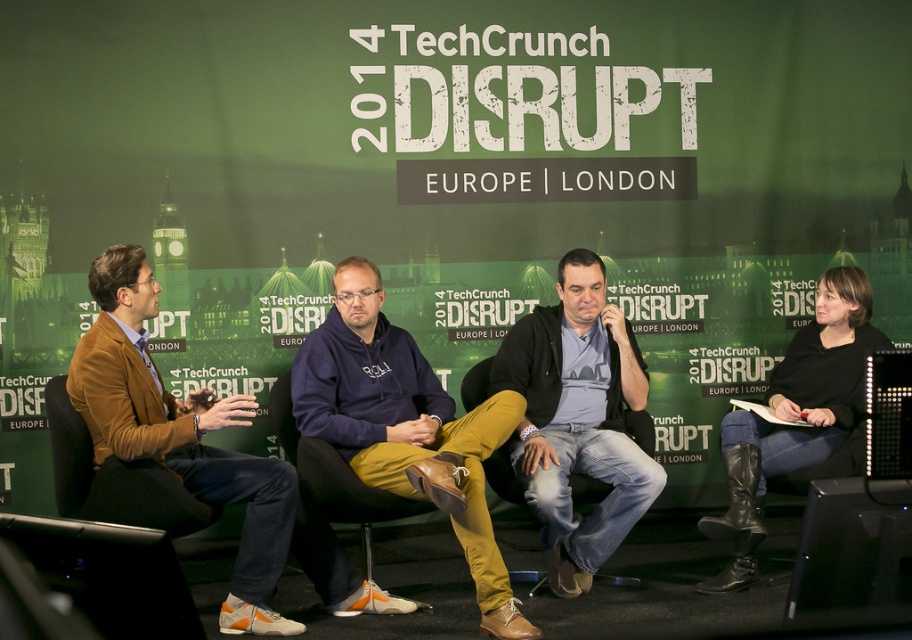
Can you confirm if dark blue hoodie at center is positioned below black leather boots at lower right?

No, dark blue hoodie at center is not below black leather boots at lower right.

Can you confirm if dark blue hoodie at center is positioned to the right of black leather boots at lower right?

In fact, dark blue hoodie at center is to the left of black leather boots at lower right.

You are a GUI agent. You are given a task and a screenshot of the screen. Output one action in this format:
    pyautogui.click(x=<x>, y=<y>)
    Task: Click on the dark blue hoodie at center
    
    Given the screenshot: What is the action you would take?
    pyautogui.click(x=406, y=428)

Which is more to the left, brown leather jacket at left or black leather boots at lower right?

brown leather jacket at left

Is brown leather jacket at left above black leather boots at lower right?

No, brown leather jacket at left is not above black leather boots at lower right.

Who is more forward, [102,285] or [710,586]?

Positioned in front is point [102,285].

At what (x,y) coordinates should I click in order to perform the action: click on brown leather jacket at left. Please return your answer as a coordinate pair (x, y). The image size is (912, 640). Looking at the image, I should click on click(x=180, y=435).

Which of these two, denim jeans at center or brown leather jacket at left, stands taller?

denim jeans at center

Can you confirm if denim jeans at center is smaller than brown leather jacket at left?

Yes.

Who is more distant from viewer, (529, 438) or (278, 476)?

The point (529, 438) is behind.

Where is `denim jeans at center`? Image resolution: width=912 pixels, height=640 pixels. denim jeans at center is located at coordinates (577, 419).